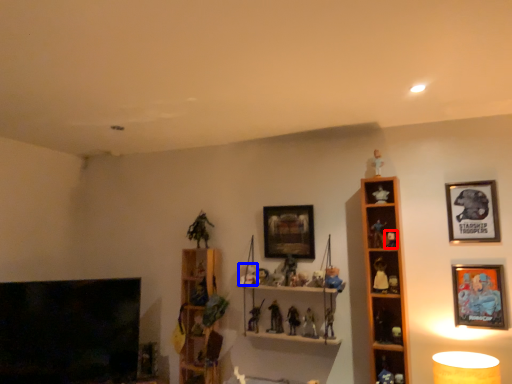
Question: Which of the following is the closest to the observer, toy (highlighted by a red box) or toy (highlighted by a blue box)?

Choices:
 (A) toy
 (B) toy

Answer: (A)